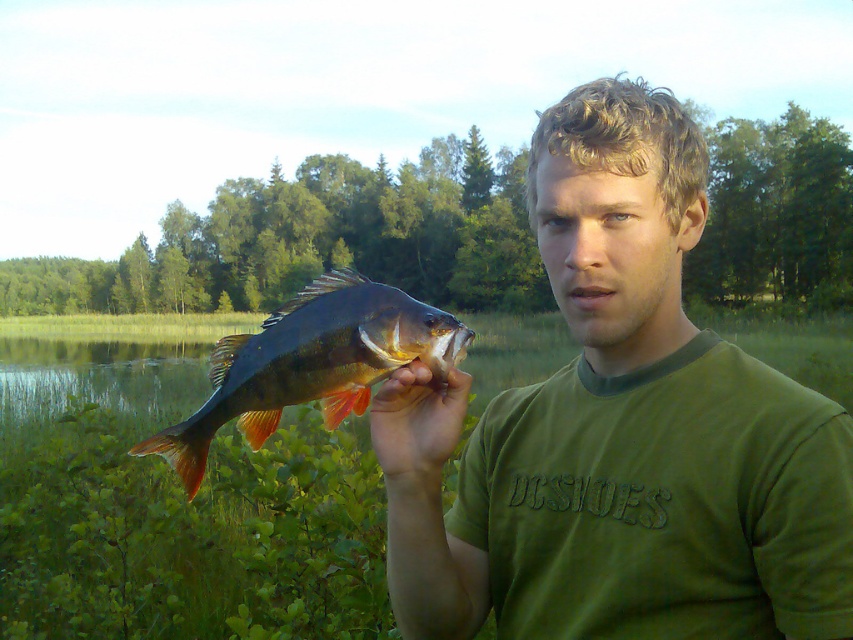
Question: Does green cotton shirt at center appear over shiny metallic fish at center?

Choices:
 (A) yes
 (B) no

Answer: (A)

Question: Which object is the farthest from the smooth skin hand at center?

Choices:
 (A) green cotton shirt at center
 (B) shiny metallic fish at center

Answer: (A)

Question: Can you confirm if green cotton shirt at center is smaller than shiny metallic fish at center?

Choices:
 (A) no
 (B) yes

Answer: (A)

Question: Is shiny metallic fish at center bigger than smooth skin hand at center?

Choices:
 (A) no
 (B) yes

Answer: (B)

Question: Which object is closer to the camera taking this photo?

Choices:
 (A) green cotton shirt at center
 (B) shiny metallic fish at center
 (C) smooth skin hand at center

Answer: (A)

Question: Which point appears farthest from the camera in this image?

Choices:
 (A) (531, 177)
 (B) (202, 470)
 (C) (379, 465)

Answer: (C)